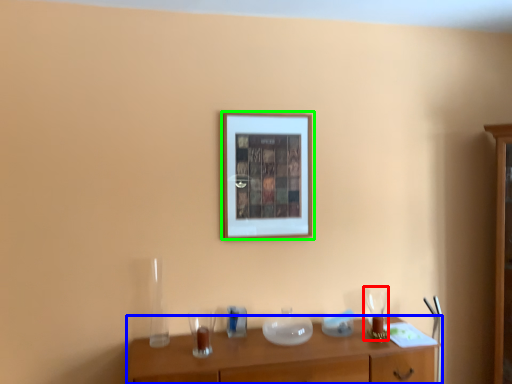
Question: Which object is the closest to the wine glass (highlighted by a red box)? Choose among these: table (highlighted by a blue box) or picture frame (highlighted by a green box).

Choices:
 (A) table
 (B) picture frame

Answer: (A)